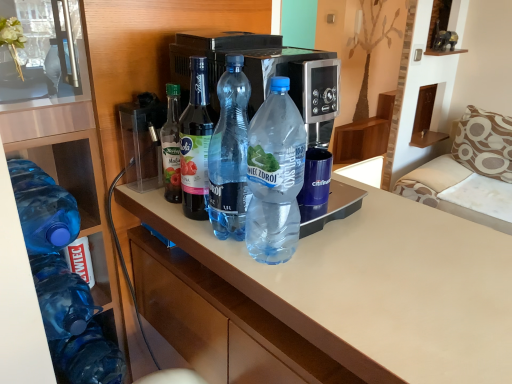
Question: Is blue translucent bottle at left, the 1th bottle in the left-to-right sequence, placed right next to transparent plastic bottle at center, the 4th bottle when ordered from left to right?

Choices:
 (A) no
 (B) yes

Answer: (A)

Question: From the image's perspective, is blue translucent bottle at left, the 5th bottle viewed from the right, on transparent plastic bottle at center, the 4th bottle when ordered from left to right?

Choices:
 (A) no
 (B) yes

Answer: (A)

Question: Is blue translucent bottle at left, the 5th bottle viewed from the right, further to camera compared to transparent plastic bottle at center, the 4th bottle when ordered from left to right?

Choices:
 (A) yes
 (B) no

Answer: (A)

Question: Are blue translucent bottle at left, the 1th bottle in the left-to-right sequence, and transparent plastic bottle at center, the second bottle when ordered from right to left, far apart?

Choices:
 (A) yes
 (B) no

Answer: (B)

Question: Can you confirm if blue translucent bottle at left, the 5th bottle viewed from the right, is smaller than transparent plastic bottle at center, the second bottle when ordered from right to left?

Choices:
 (A) yes
 (B) no

Answer: (B)

Question: From the image's perspective, relative to beige fabric sofa at right, is translucent plastic bottles at center above or below?

Choices:
 (A) below
 (B) above

Answer: (A)

Question: From a real-world perspective, is translucent plastic bottles at center physically located above or below beige fabric sofa at right?

Choices:
 (A) above
 (B) below

Answer: (A)

Question: Relative to beige fabric sofa at right, is translucent plastic bottles at center in front or behind?

Choices:
 (A) behind
 (B) front

Answer: (B)

Question: From their relative heights in the image, would you say translucent plastic bottles at center is taller or shorter than beige fabric sofa at right?

Choices:
 (A) short
 (B) tall

Answer: (B)

Question: In terms of height, does transparent plastic bottle at center, which is counted as the third bottle, starting from the right, look taller or shorter compared to transparent plastic bottle at center, the second bottle when ordered from right to left?

Choices:
 (A) short
 (B) tall

Answer: (A)

Question: Based on their positions, is transparent plastic bottle at center, which is counted as the third bottle, starting from the right, located to the left or right of transparent plastic bottle at center, the 4th bottle when ordered from left to right?

Choices:
 (A) left
 (B) right

Answer: (A)

Question: Looking at the image, does transparent plastic bottle at center, which is the 3th bottle from left to right, seem bigger or smaller compared to transparent plastic bottle at center, the second bottle when ordered from right to left?

Choices:
 (A) big
 (B) small

Answer: (A)

Question: Is point (188, 210) positioned closer to the camera than point (232, 180)?

Choices:
 (A) closer
 (B) farther

Answer: (B)

Question: In terms of height, does transparent plastic container at upper left look taller or shorter compared to blue translucent bottle at center, which is counted as the 5th bottle, starting from the left?

Choices:
 (A) tall
 (B) short

Answer: (B)

Question: Is transparent plastic container at upper left in front of or behind blue translucent bottle at center, which appears as the 1th bottle when viewed from the right, in the image?

Choices:
 (A) behind
 (B) front

Answer: (A)